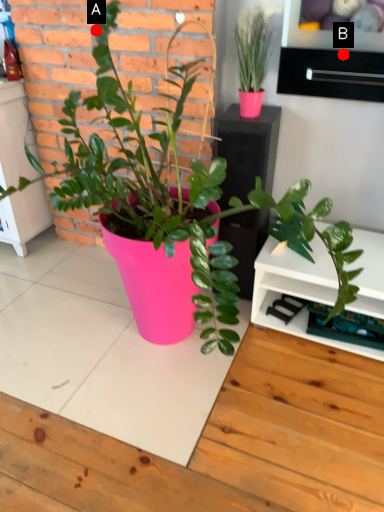
Question: Two points are circled on the image, labeled by A and B beside each circle. Which point is farther to the camera?

Choices:
 (A) A is further
 (B) B is further

Answer: (A)